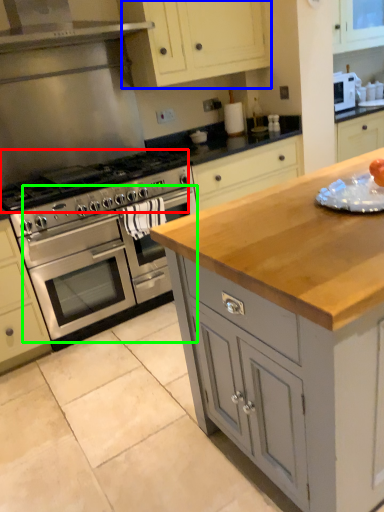
Question: Which object is positioned closest to gas stove (highlighted by a red box)? Select from cabinetry (highlighted by a blue box) and oven (highlighted by a green box).

Choices:
 (A) cabinetry
 (B) oven

Answer: (B)